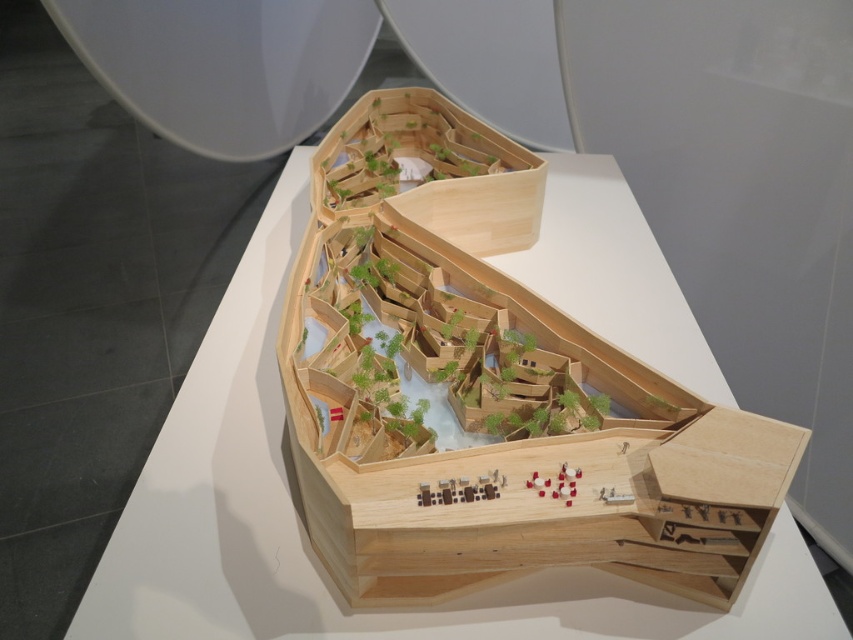
Who is shorter, natural wood boat at center or natural wood model at center?

With less height is natural wood boat at center.

Between natural wood boat at center and natural wood model at center, which one appears on the right side from the viewer's perspective?

From the viewer's perspective, natural wood boat at center appears more on the right side.

Find the location of `natural wood boat at center`. natural wood boat at center is located at coordinates (492, 388).